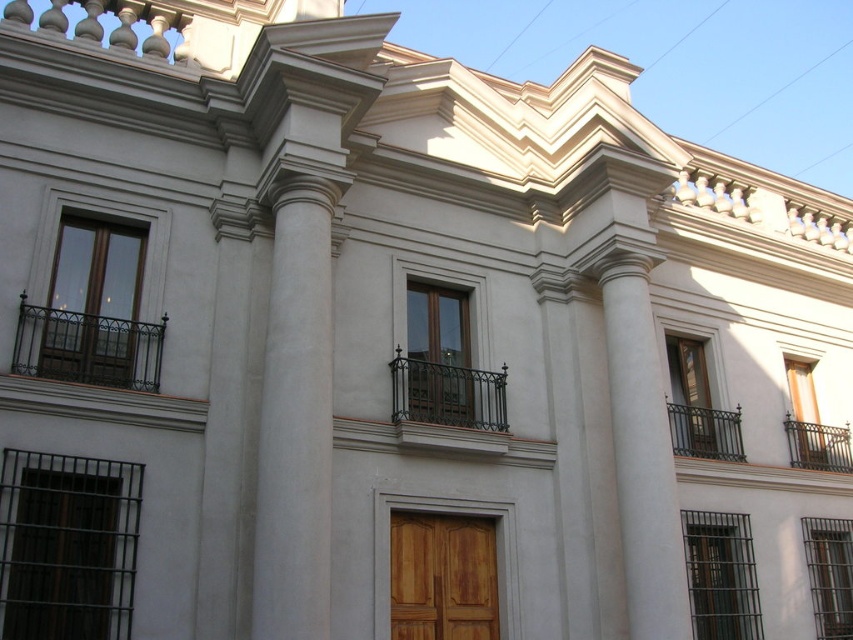
Which of these two, wooden at center or green wrought iron balcony at lower right, stands taller?

With more height is green wrought iron balcony at lower right.

Does wooden at center appear on the right side of green wrought iron balcony at lower right?

Incorrect, wooden at center is not on the right side of green wrought iron balcony at lower right.

Identify the location of wooden at center. (442, 577).

The image size is (853, 640). In order to click on wooden at center in this screenshot , I will do `click(442, 577)`.